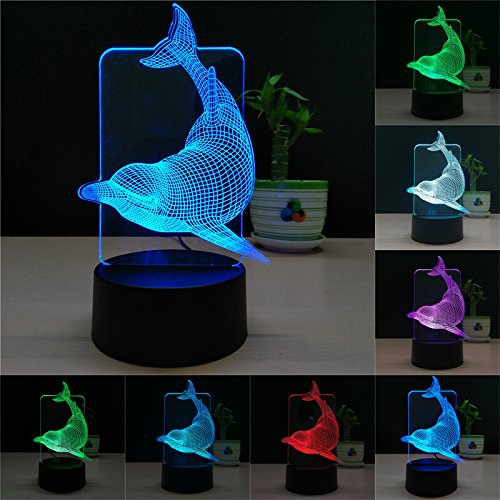
Where is `led light`? led light is located at coordinates (155, 175).